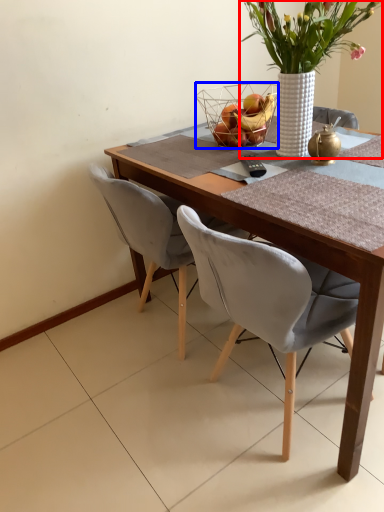
Question: Among these objects, which one is nearest to the camera, houseplant (highlighted by a red box) or basket (highlighted by a blue box)?

Choices:
 (A) houseplant
 (B) basket

Answer: (A)